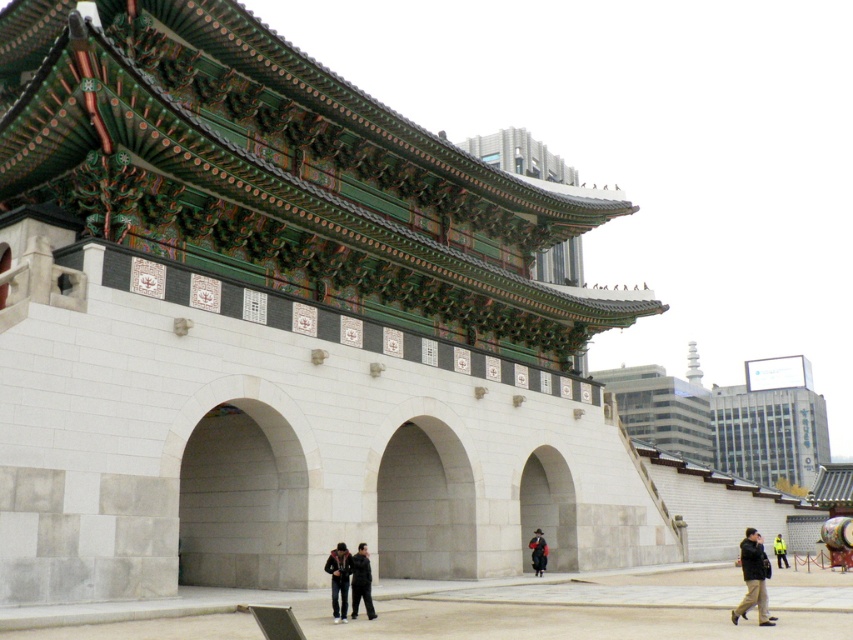
You are a fashion stylist trying to decide between two jackets displayed at the center of the scene. The dark blue jacket at center and the black leather jacket at center. Which jacket is placed on top of the other?

The dark blue jacket at center is positioned over the black leather jacket at center, so the dark blue jacket is on top.

Consider the image. You are a photographer planning to take a photo of the Gwanghwamun gate. You notice two jackets hanging on a rack in front of the gate. The jackets are the dark blue jacket at center and the dark gray jacket at center. Since you want to ensure both jackets fit within the frame without overlapping, which jacket should you move closer to the camera to maintain their current positions?

The dark blue jacket at center has a lesser width compared to the dark gray jacket at center. To ensure both jackets fit within the frame without overlapping, move the wider dark gray jacket at center closer to the camera since it occupies more space and requires more room to fit properly.